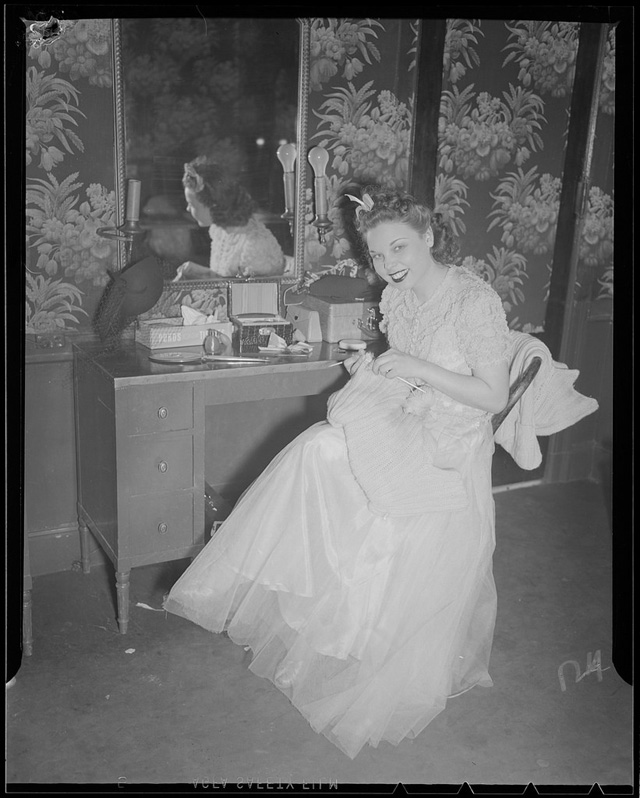
This screenshot has height=798, width=640. I want to click on perfume, so click(x=211, y=345).